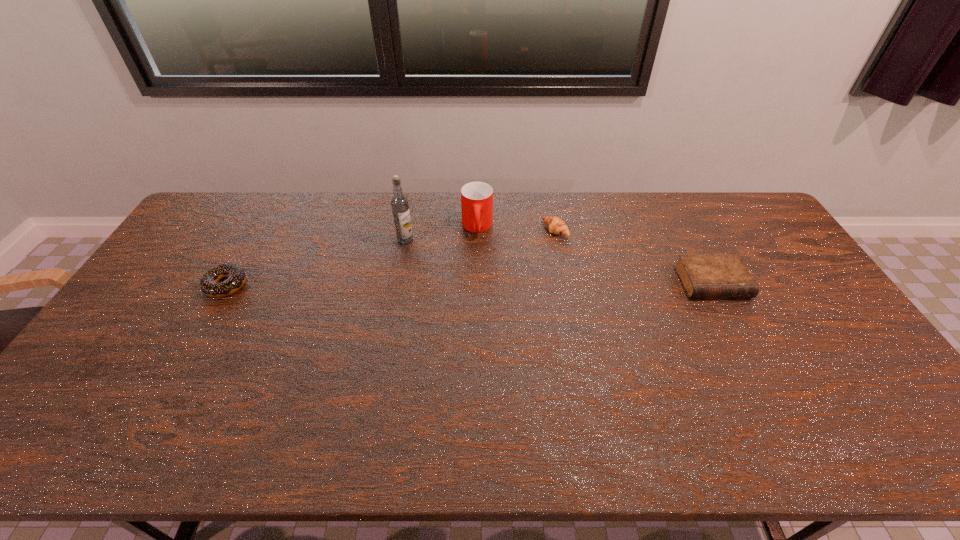
Find the location of `vacant space on the desktop that is between the doughnut and the diary and is positioned on the label of the second object from left to right`. vacant space on the desktop that is between the doughnut and the diary and is positioned on the label of the second object from left to right is located at coordinates (406, 285).

Where is `free space on the desktop that is between the doughnut and the diary and is positioned on the front-facing side of the pastry`? free space on the desktop that is between the doughnut and the diary and is positioned on the front-facing side of the pastry is located at coordinates (463, 284).

The width and height of the screenshot is (960, 540). In order to click on vacant spot on the desktop that is between the doughnut and the rightmost object and is positioned on the side of the cup with the handle in this screenshot , I will do `click(476, 284)`.